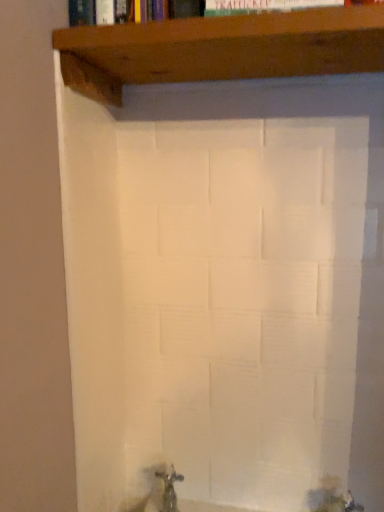
Image resolution: width=384 pixels, height=512 pixels. Describe the element at coordinates (220, 49) in the screenshot. I see `brown wood shelf at upper center` at that location.

Find the location of a particular element. Image resolution: width=384 pixels, height=512 pixels. brown wood shelf at upper center is located at coordinates (220, 49).

Locate an element on the screen. The width and height of the screenshot is (384, 512). metallic silver tap at lower center is located at coordinates (169, 488).

What do you see at coordinates (169, 488) in the screenshot? I see `metallic silver tap at lower center` at bounding box center [169, 488].

Measure the distance between point (175, 496) and camera.

They are 36.22 inches apart.

Image resolution: width=384 pixels, height=512 pixels. I want to click on brown wood shelf at upper center, so click(220, 49).

Can you confirm if metallic silver tap at lower center is positioned to the left of brown wood shelf at upper center?

Yes, metallic silver tap at lower center is to the left of brown wood shelf at upper center.

Considering the positions of objects metallic silver tap at lower center and brown wood shelf at upper center in the image provided, who is in front, metallic silver tap at lower center or brown wood shelf at upper center?

brown wood shelf at upper center is more forward.

Considering the points (170, 498) and (220, 26), which point is in front, point (170, 498) or point (220, 26)?

The point (220, 26) is closer.

From the image's perspective, is metallic silver tap at lower center located beneath brown wood shelf at upper center?

Yes, from the image's perspective, metallic silver tap at lower center is below brown wood shelf at upper center.

Looking at this image, from a real-world perspective, is metallic silver tap at lower center physically located above or below brown wood shelf at upper center?

Clearly, from a real-world perspective, metallic silver tap at lower center is below brown wood shelf at upper center.

In the scene shown: Between metallic silver tap at lower center and brown wood shelf at upper center, which one has larger width?

brown wood shelf at upper center.

Who is taller, metallic silver tap at lower center or brown wood shelf at upper center?

metallic silver tap at lower center.

Which of these two, metallic silver tap at lower center or brown wood shelf at upper center, is smaller?

metallic silver tap at lower center is smaller.

Could brown wood shelf at upper center be considered to be inside metallic silver tap at lower center?

Definitely not — brown wood shelf at upper center is not inside metallic silver tap at lower center.

Is metallic silver tap at lower center in contact with brown wood shelf at upper center?

There is a gap between metallic silver tap at lower center and brown wood shelf at upper center.

Based on the photo, is metallic silver tap at lower center positioned with its back to brown wood shelf at upper center?

No, metallic silver tap at lower center's orientation is not away from brown wood shelf at upper center.

How many degrees apart are the facing directions of metallic silver tap at lower center and brown wood shelf at upper center?

The angular difference between metallic silver tap at lower center and brown wood shelf at upper center is 1.1 degrees.

You are a GUI agent. You are given a task and a screenshot of the screen. Output one action in this format:
    pyautogui.click(x=<x>, y=<y>)
    Task: Click on the shelf that appears above the metallic silver tap at lower center (from the image's perspective)
    
    Given the screenshot: What is the action you would take?
    pyautogui.click(x=220, y=49)

Considering the positions of objects brown wood shelf at upper center and metallic silver tap at lower center in the image provided, who is more to the left, brown wood shelf at upper center or metallic silver tap at lower center?

metallic silver tap at lower center is more to the left.

Is brown wood shelf at upper center positioned behind metallic silver tap at lower center?

No, brown wood shelf at upper center is closer to the viewer.

Considering the positions of point (61, 49) and point (163, 479), is point (61, 49) closer or farther from the camera than point (163, 479)?

Point (61, 49) is positioned closer to the camera compared to point (163, 479).

From the image's perspective, which one is positioned lower, brown wood shelf at upper center or metallic silver tap at lower center?

From the image's view, metallic silver tap at lower center is below.

Looking at this image, from a real-world perspective, is brown wood shelf at upper center positioned above or below metallic silver tap at lower center?

Clearly, from a real-world perspective, brown wood shelf at upper center is above metallic silver tap at lower center.

Does brown wood shelf at upper center have a lesser width compared to metallic silver tap at lower center?

In fact, brown wood shelf at upper center might be wider than metallic silver tap at lower center.

Between brown wood shelf at upper center and metallic silver tap at lower center, which one has less height?

Standing shorter between the two is brown wood shelf at upper center.

Who is smaller, brown wood shelf at upper center or metallic silver tap at lower center?

Smaller between the two is metallic silver tap at lower center.

Is brown wood shelf at upper center completely or partially outside of metallic silver tap at lower center?

Absolutely, brown wood shelf at upper center is external to metallic silver tap at lower center.

Is brown wood shelf at upper center in contact with metallic silver tap at lower center?

No.

Does brown wood shelf at upper center turn towards metallic silver tap at lower center?

No, brown wood shelf at upper center is not turned towards metallic silver tap at lower center.

What's the angular difference between brown wood shelf at upper center and metallic silver tap at lower center's facing directions?

brown wood shelf at upper center and metallic silver tap at lower center are facing 1.1 degrees away from each other.

The image size is (384, 512). Identify the location of tap below the brown wood shelf at upper center (from the image's perspective). (169, 488).

Locate an element on the screen. This screenshot has width=384, height=512. shelf in front of the metallic silver tap at lower center is located at coordinates (220, 49).

Locate an element on the screen. tap on the left of brown wood shelf at upper center is located at coordinates (169, 488).